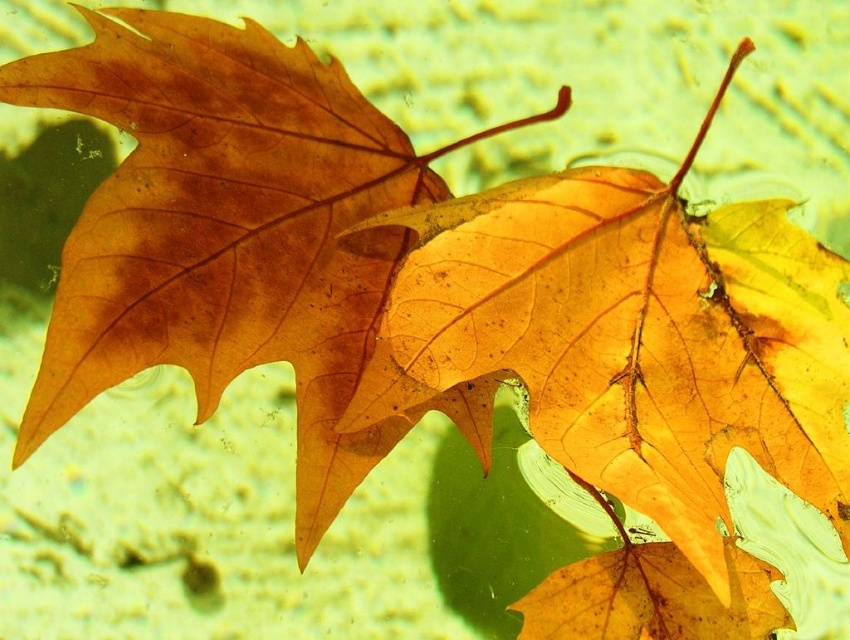
Question: Which of the following is the closest to the observer?

Choices:
 (A) (92, 378)
 (B) (769, 406)

Answer: (A)

Question: Can you confirm if shiny orange leaf at center is wider than matte orange leaf at center?

Choices:
 (A) yes
 (B) no

Answer: (B)

Question: In this image, where is shiny orange leaf at center located relative to matte orange leaf at center?

Choices:
 (A) right
 (B) left

Answer: (A)

Question: Is shiny orange leaf at center bigger than matte orange leaf at center?

Choices:
 (A) yes
 (B) no

Answer: (A)

Question: Which point appears farthest from the camera in this image?

Choices:
 (A) (95, 28)
 (B) (788, 326)

Answer: (A)